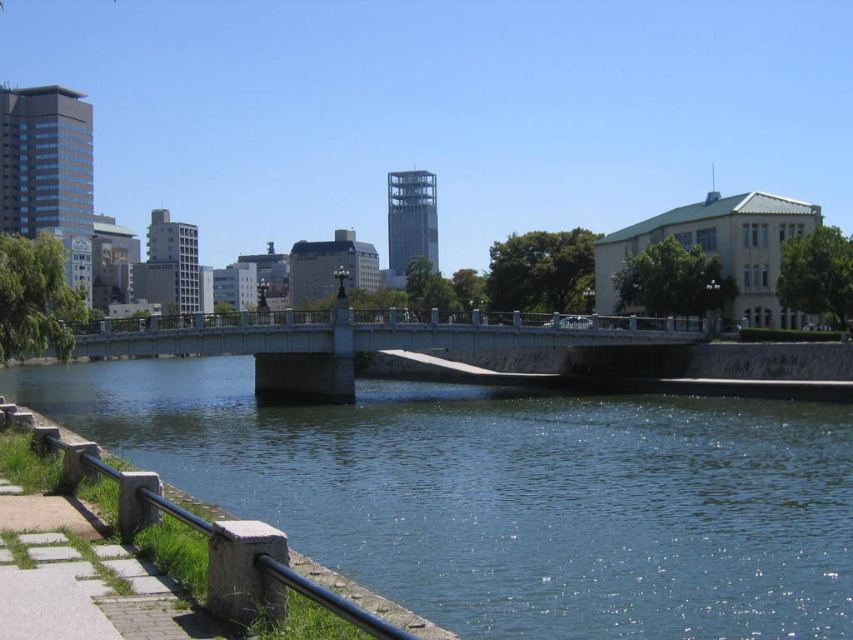
Which is more to the right, clear blue water at center or stone textured rail at lower left?

stone textured rail at lower left is more to the right.

Can you confirm if clear blue water at center is bigger than stone textured rail at lower left?

Yes, clear blue water at center is bigger than stone textured rail at lower left.

Is point (393, 410) more distant than point (277, 563)?

Yes, it is.

You are a GUI agent. You are given a task and a screenshot of the screen. Output one action in this format:
    pyautogui.click(x=<x>, y=<y>)
    Task: Click on the clear blue water at center
    This screenshot has width=853, height=640.
    Given the screenshot: What is the action you would take?
    pyautogui.click(x=508, y=496)

Who is shorter, smooth concrete bridge at center or stone textured rail at lower left?

stone textured rail at lower left is shorter.

Based on the photo, does smooth concrete bridge at center have a larger size compared to stone textured rail at lower left?

Indeed, smooth concrete bridge at center has a larger size compared to stone textured rail at lower left.

Describe the element at coordinates (357, 340) in the screenshot. I see `smooth concrete bridge at center` at that location.

The image size is (853, 640). Find the location of `smooth concrete bridge at center`. smooth concrete bridge at center is located at coordinates (357, 340).

Between point (561, 476) and point (376, 321), which one is positioned in front?

Point (561, 476)

Consider the image. Which of these two, clear blue water at center or smooth concrete bridge at center, stands shorter?

With less height is clear blue water at center.

The width and height of the screenshot is (853, 640). In order to click on clear blue water at center in this screenshot , I will do `click(508, 496)`.

Where is `clear blue water at center`? This screenshot has height=640, width=853. clear blue water at center is located at coordinates (508, 496).